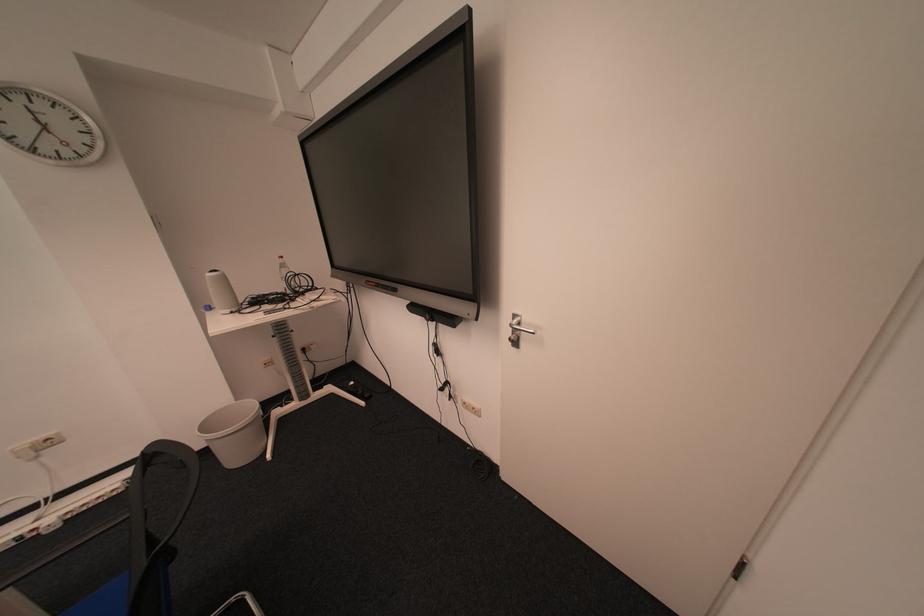
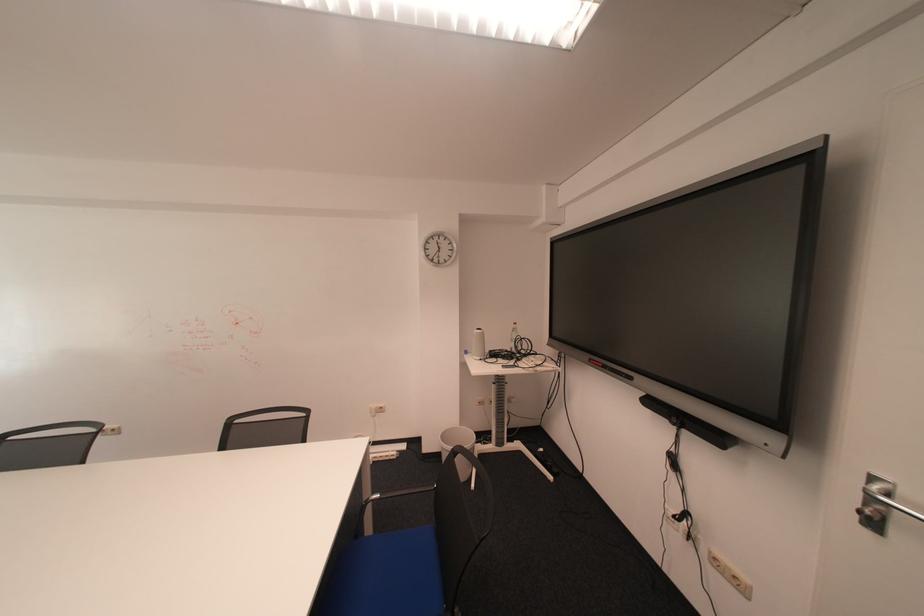
Find the pixel in the second image that matches the point at 219,313 in the first image.

(477, 355)